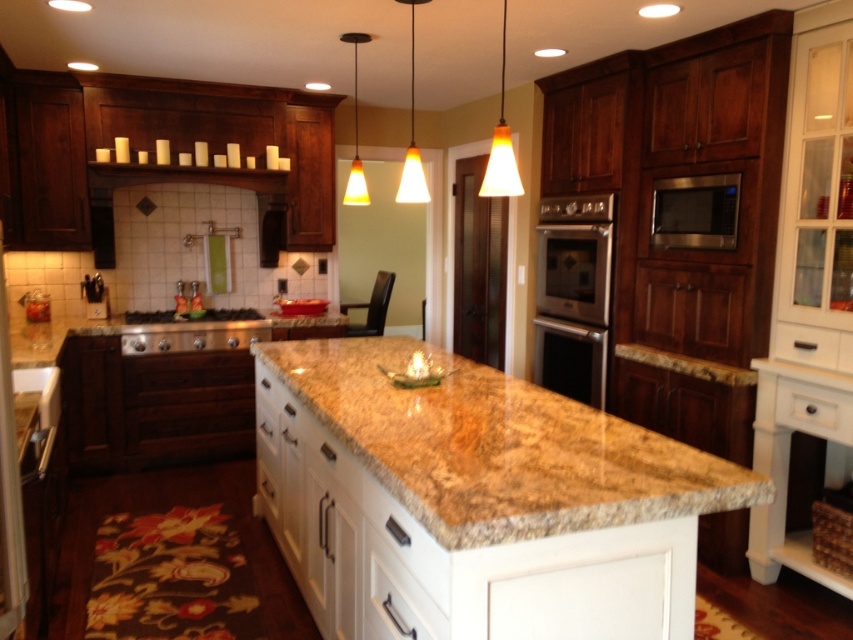
Question: Can you confirm if brown granite countertop at center is positioned to the right of satin silver microwave at upper right?

Choices:
 (A) yes
 (B) no

Answer: (B)

Question: Which object appears closest to the camera in this image?

Choices:
 (A) yellow glass cone at center
 (B) granite at center

Answer: (A)

Question: Which of the following is the closest to the observer?

Choices:
 (A) satin silver microwave at upper right
 (B) granite at center
 (C) matte glass pendant light at center

Answer: (C)

Question: Can you confirm if granite at center is positioned to the right of orange glass pendant light at center?

Choices:
 (A) yes
 (B) no

Answer: (B)

Question: Among these objects, which one is nearest to the camera?

Choices:
 (A) granite at center
 (B) orange glass pendant light at center
 (C) matte glass pendant light at center

Answer: (C)

Question: Can you confirm if brown granite countertop at center is positioned to the right of satin silver microwave at upper right?

Choices:
 (A) yes
 (B) no

Answer: (B)